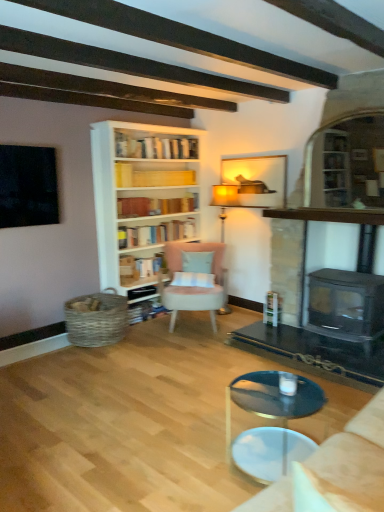
Image resolution: width=384 pixels, height=512 pixels. Identify the location of free space in front of woven brown picnic basket at lower left. (83, 361).